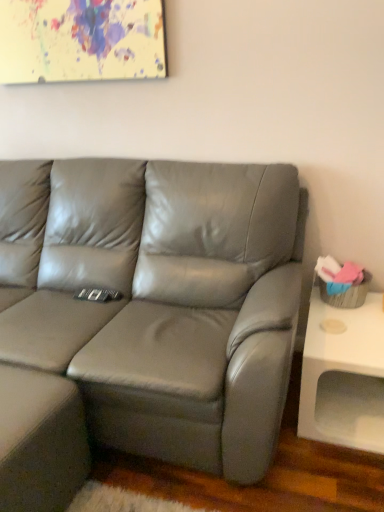
Question: From the image's perspective, does painted canvas at upper center appear lower than satin gray leather couch at center?

Choices:
 (A) yes
 (B) no

Answer: (B)

Question: Is painted canvas at upper center at the right side of satin gray leather couch at center?

Choices:
 (A) no
 (B) yes

Answer: (A)

Question: Does painted canvas at upper center turn towards satin gray leather couch at center?

Choices:
 (A) yes
 (B) no

Answer: (B)

Question: From a real-world perspective, is painted canvas at upper center positioned under satin gray leather couch at center based on gravity?

Choices:
 (A) no
 (B) yes

Answer: (A)

Question: Considering the relative positions of painted canvas at upper center and satin gray leather couch at center in the image provided, is painted canvas at upper center in front of satin gray leather couch at center?

Choices:
 (A) yes
 (B) no

Answer: (B)

Question: Considering the relative sizes of painted canvas at upper center and satin gray leather couch at center in the image provided, is painted canvas at upper center shorter than satin gray leather couch at center?

Choices:
 (A) yes
 (B) no

Answer: (A)

Question: Is painted canvas at upper center at the right side of matte gray footrest at lower left?

Choices:
 (A) no
 (B) yes

Answer: (B)

Question: From the image's perspective, is painted canvas at upper center on top of matte gray footrest at lower left?

Choices:
 (A) yes
 (B) no

Answer: (A)

Question: Does painted canvas at upper center have a lesser width compared to matte gray footrest at lower left?

Choices:
 (A) yes
 (B) no

Answer: (A)

Question: From the image's perspective, does painted canvas at upper center appear lower than matte gray footrest at lower left?

Choices:
 (A) no
 (B) yes

Answer: (A)

Question: Is painted canvas at upper center shorter than matte gray footrest at lower left?

Choices:
 (A) yes
 (B) no

Answer: (A)

Question: Does painted canvas at upper center have a smaller size compared to matte gray footrest at lower left?

Choices:
 (A) no
 (B) yes

Answer: (B)

Question: From the image's perspective, does satin gray leather couch at center appear lower than matte gray footrest at lower left?

Choices:
 (A) no
 (B) yes

Answer: (A)